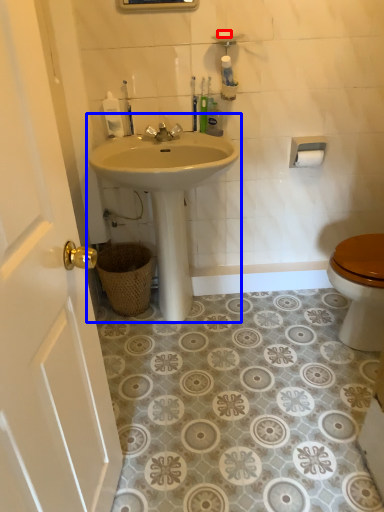
Question: Which object appears closest to the camera in this image, soap (highlighted by a red box) or sink (highlighted by a blue box)?

Choices:
 (A) soap
 (B) sink

Answer: (B)